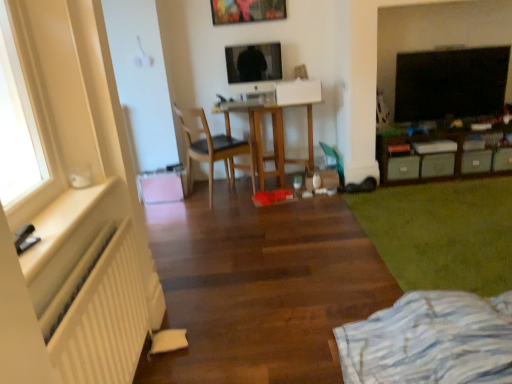
The width and height of the screenshot is (512, 384). Find the location of `free space above green matte storage unit at right (from a real-world perspective)`. free space above green matte storage unit at right (from a real-world perspective) is located at coordinates (452, 125).